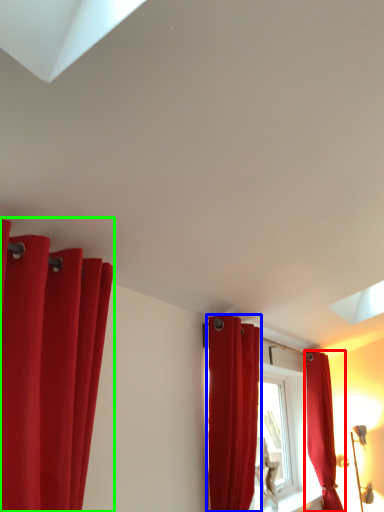
Question: Considering the real-world distances, which object is closest to curtain (highlighted by a red box)? curtain (highlighted by a blue box) or curtain (highlighted by a green box).

Choices:
 (A) curtain
 (B) curtain

Answer: (A)